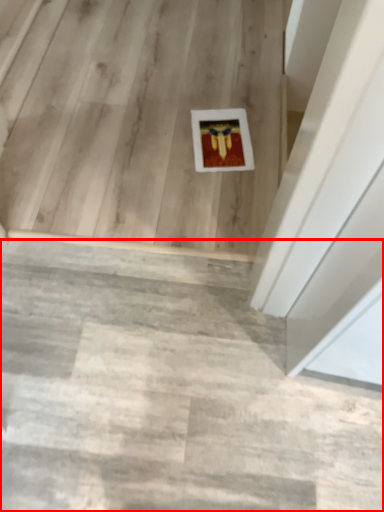
Question: From the image's perspective, what is the correct spatial positioning of stairwell (annotated by the red box) in reference to stairwell?

Choices:
 (A) below
 (B) above

Answer: (A)